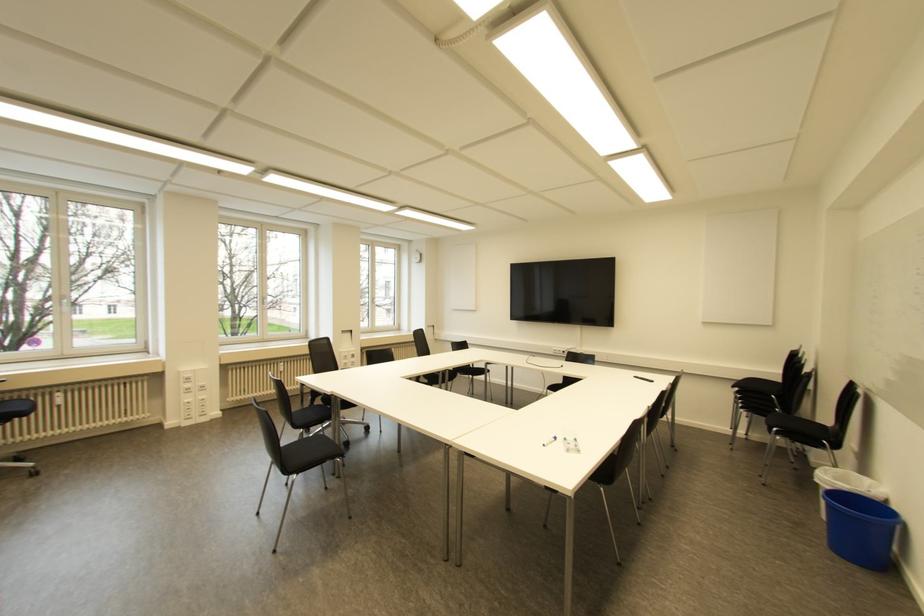
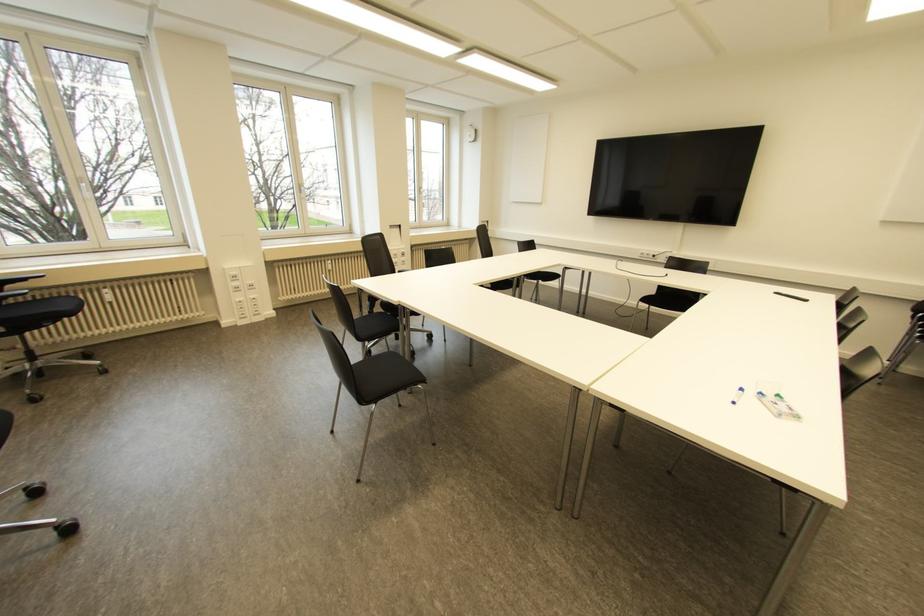
In the second image, find the point that corresponds to [263,298] in the first image.

(299, 185)